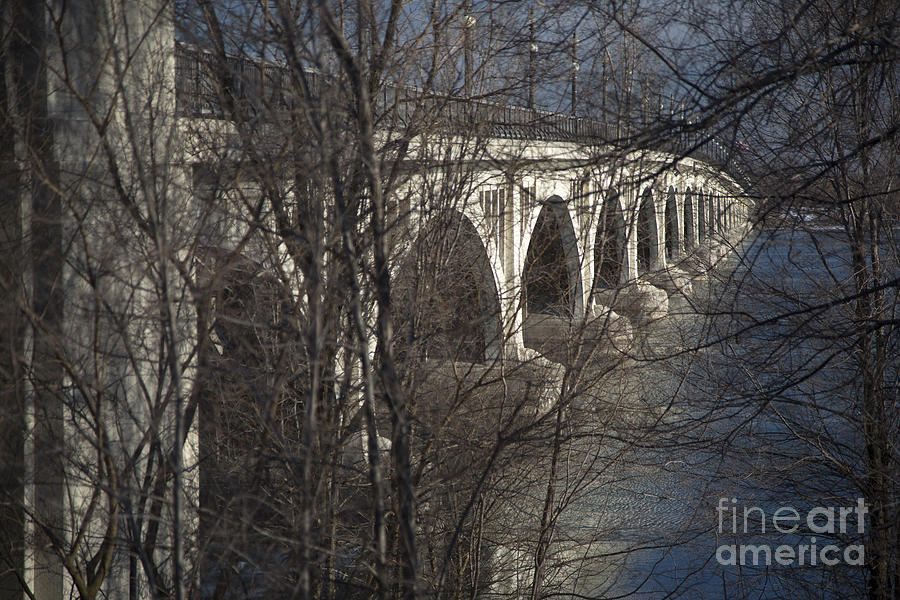
Identify the location of lights. (x=463, y=21), (x=528, y=47), (x=574, y=71), (x=668, y=111).